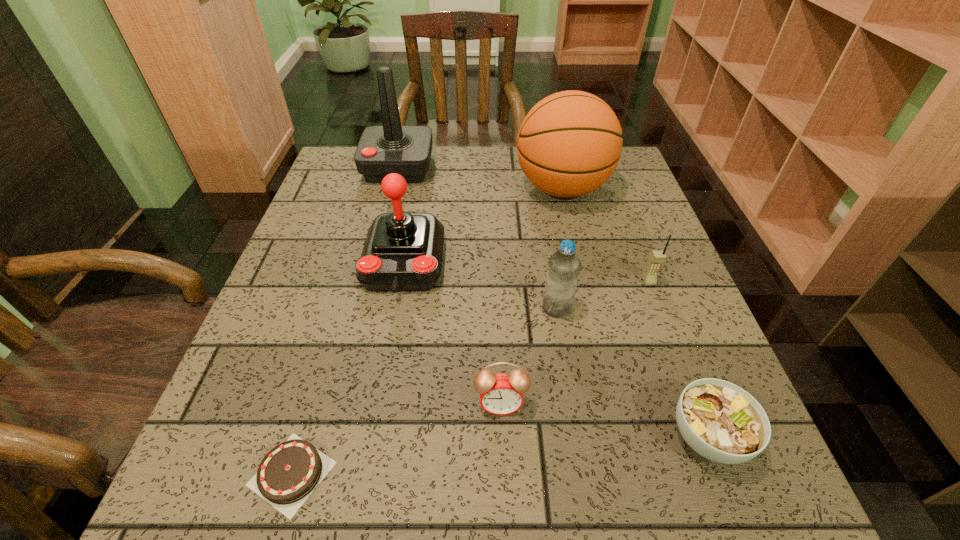
At what (x,y) coordinates should I click in order to perform the action: click on soup bowl located at the near edge. Please return your answer as a coordinate pair (x, y). This screenshot has width=960, height=540. Looking at the image, I should click on (722, 422).

At what (x,y) coordinates should I click in order to perform the action: click on chocolate cake present at the near edge. Please return your answer as a coordinate pair (x, y). Looking at the image, I should click on (288, 474).

This screenshot has height=540, width=960. Find the location of `joystick that is positioned at the left edge`. joystick that is positioned at the left edge is located at coordinates (406, 150).

Identify the location of chocolate cake that is at the left edge. (288, 474).

You are a GUI agent. You are given a task and a screenshot of the screen. Output one action in this format:
    pyautogui.click(x=<x>, y=<y>)
    Task: Click on the basketball at the right edge
    
    Given the screenshot: What is the action you would take?
    pyautogui.click(x=569, y=144)

Find the location of a particular element. cellular telephone that is at the right edge is located at coordinates (657, 257).

The height and width of the screenshot is (540, 960). Find the location of `soup bowl that is at the right edge`. soup bowl that is at the right edge is located at coordinates (722, 422).

Image resolution: width=960 pixels, height=540 pixels. Identify the location of object present at the far left corner. (406, 150).

Find the location of `object that is at the near left corner`. object that is at the near left corner is located at coordinates (288, 474).

The width and height of the screenshot is (960, 540). I want to click on object present at the far right corner, so click(x=569, y=144).